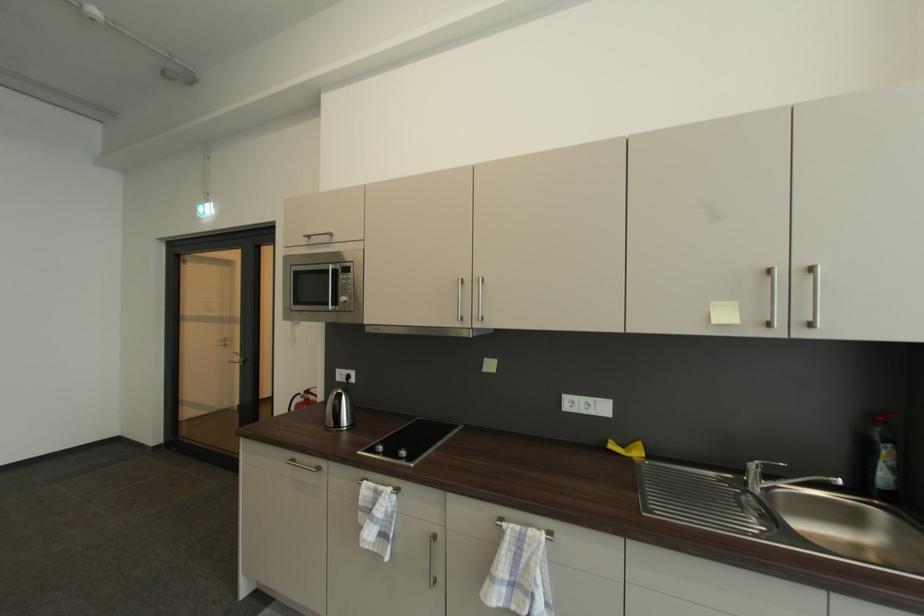
Image resolution: width=924 pixels, height=616 pixels. I want to click on microwave door handle, so click(x=331, y=286).